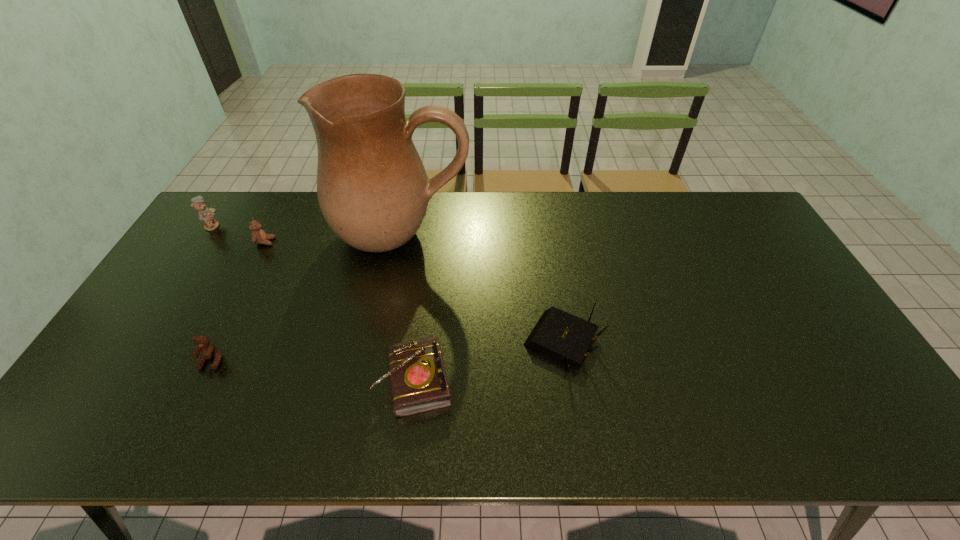
Find the location of a particular element. This screenshot has width=960, height=540. free space located 0.120m on the face of the nearest teddy bear is located at coordinates (185, 415).

Find the location of a particular element. vacant space located 0.140m on the front of the router is located at coordinates (577, 431).

Image resolution: width=960 pixels, height=540 pixels. Identify the location of free point located on the back of the diary. click(422, 314).

Identify the location of cream pitcher that is at the far edge. Image resolution: width=960 pixels, height=540 pixels. (373, 190).

Locate an element on the screen. object that is at the near edge is located at coordinates (418, 380).

Locate an element on the screen. The width and height of the screenshot is (960, 540). object at the left edge is located at coordinates (205, 214).

You are a GUI agent. You are given a task and a screenshot of the screen. Output one action in this format:
    pyautogui.click(x=<x>, y=<y>)
    Task: Click on the object situated at the far left corner
    This screenshot has width=960, height=540.
    Given the screenshot: What is the action you would take?
    pyautogui.click(x=205, y=214)

You are a GUI agent. You are given a task and a screenshot of the screen. Output one action in this format:
    pyautogui.click(x=<x>, y=<y>)
    Task: Click on the vacant space at the far edge
    Image resolution: width=960 pixels, height=540 pixels.
    Given the screenshot: What is the action you would take?
    pyautogui.click(x=563, y=202)

The image size is (960, 540). In order to click on free space at the near edge of the desktop in this screenshot , I will do `click(432, 443)`.

In the image, there is a desktop. What are the coordinates of `vacant space at the left edge` in the screenshot? It's located at (184, 259).